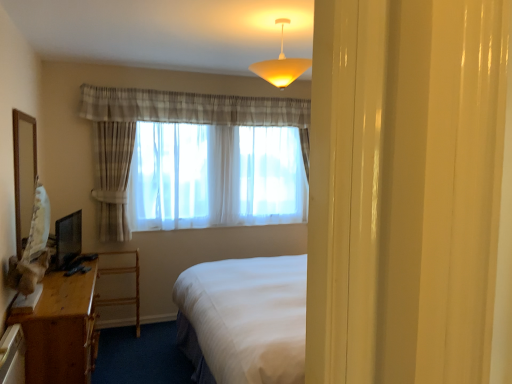
Question: Is sheer white curtain at center placed right next to matte black monitor at left?

Choices:
 (A) no
 (B) yes

Answer: (A)

Question: Does sheer white curtain at center appear on the left side of matte black monitor at left?

Choices:
 (A) no
 (B) yes

Answer: (A)

Question: Does sheer white curtain at center have a smaller size compared to matte black monitor at left?

Choices:
 (A) yes
 (B) no

Answer: (B)

Question: Considering the relative positions of sheer white curtain at center and matte black monitor at left in the image provided, is sheer white curtain at center behind matte black monitor at left?

Choices:
 (A) no
 (B) yes

Answer: (B)

Question: Is sheer white curtain at center not close to matte black monitor at left?

Choices:
 (A) no
 (B) yes

Answer: (B)

Question: Considering the positions of point (73, 221) and point (15, 173), is point (73, 221) closer or farther from the camera than point (15, 173)?

Choices:
 (A) farther
 (B) closer

Answer: (A)

Question: Relative to wooden mirror at left, is matte black monitor at left in front or behind?

Choices:
 (A) front
 (B) behind

Answer: (B)

Question: From their relative heights in the image, would you say matte black monitor at left is taller or shorter than wooden mirror at left?

Choices:
 (A) short
 (B) tall

Answer: (A)

Question: Looking at their shapes, would you say matte black monitor at left is wider or thinner than wooden mirror at left?

Choices:
 (A) thin
 (B) wide

Answer: (B)

Question: Considering the positions of wooden desk at lower left and sheer white curtain at center in the image, is wooden desk at lower left taller or shorter than sheer white curtain at center?

Choices:
 (A) short
 (B) tall

Answer: (A)

Question: From a real-world perspective, is wooden desk at lower left above or below sheer white curtain at center?

Choices:
 (A) below
 (B) above

Answer: (A)

Question: Looking at their shapes, would you say wooden desk at lower left is wider or thinner than sheer white curtain at center?

Choices:
 (A) wide
 (B) thin

Answer: (A)

Question: Visually, is wooden desk at lower left positioned to the left or to the right of sheer white curtain at center?

Choices:
 (A) left
 (B) right

Answer: (A)

Question: From the image's perspective, is matte yellow plastic lampshade at upper center located above or below sheer white curtain at center?

Choices:
 (A) below
 (B) above

Answer: (B)

Question: Considering the positions of matte yellow plastic lampshade at upper center and sheer white curtain at center in the image, is matte yellow plastic lampshade at upper center taller or shorter than sheer white curtain at center?

Choices:
 (A) tall
 (B) short

Answer: (B)